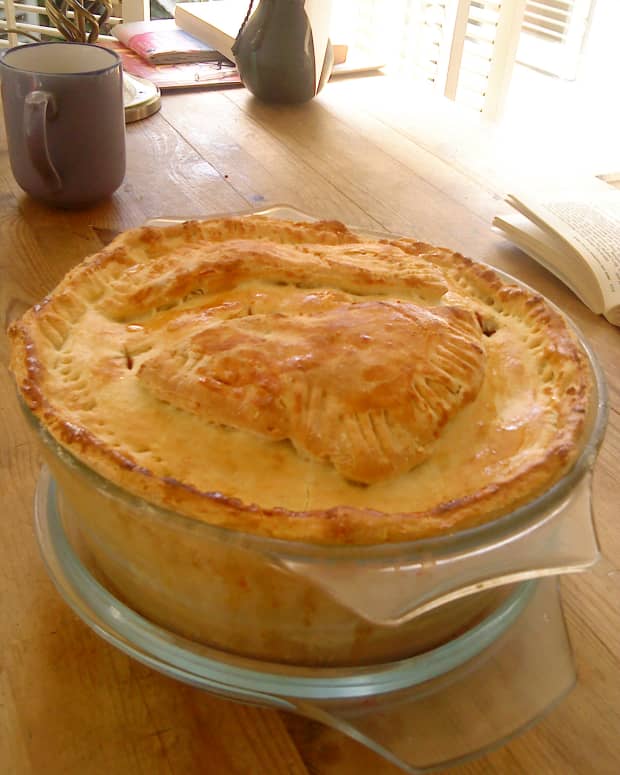
Find the location of a particular element. Image resolution: width=620 pixels, height=775 pixels. cup rim is located at coordinates (49, 73).